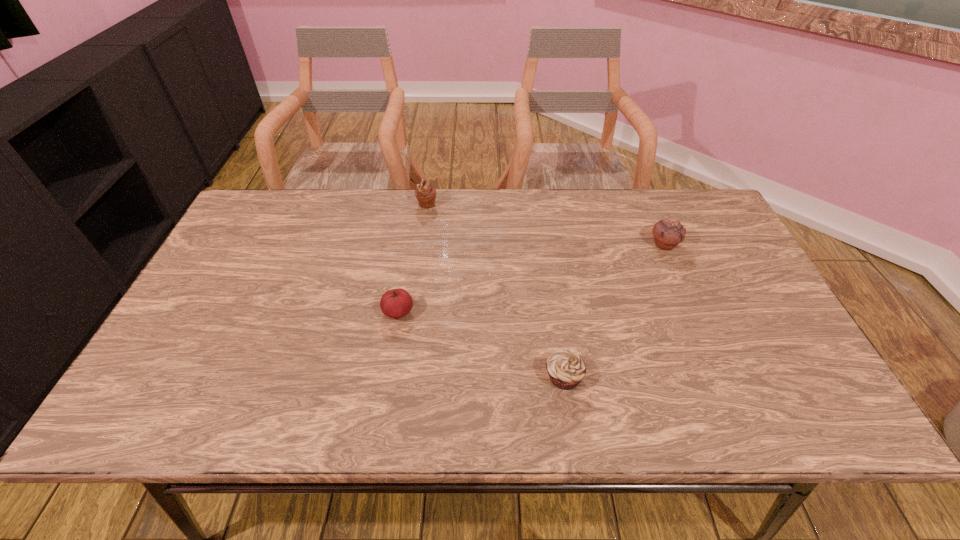
Locate an element on the screen. Image resolution: width=960 pixels, height=540 pixels. the farthest muffin is located at coordinates (425, 193).

You are a GUI agent. You are given a task and a screenshot of the screen. Output one action in this format:
    pyautogui.click(x=<x>, y=<y>)
    Task: Click on the leftmost muffin
    
    Given the screenshot: What is the action you would take?
    pyautogui.click(x=425, y=193)

Where is `the second shortest muffin`? Image resolution: width=960 pixels, height=540 pixels. the second shortest muffin is located at coordinates (667, 233).

Find the location of a particular element. The height and width of the screenshot is (540, 960). the rightmost muffin is located at coordinates (667, 233).

Locate an element on the screen. This screenshot has width=960, height=540. the third farthest object is located at coordinates (396, 303).

At what (x,y) coordinates should I click in order to perform the action: click on the second muffin from right to left. Please return your answer as a coordinate pair (x, y). Looking at the image, I should click on (566, 369).

Identify the location of the shortest muffin. [566, 369].

Identify the location of blank area located 0.110m on the right of the leftmost muffin. The height and width of the screenshot is (540, 960). (471, 205).

Find the location of a particular element. free space located 0.340m on the front of the second nearest muffin is located at coordinates point(712,355).

This screenshot has height=540, width=960. Find the location of `vacant space located 0.310m on the left of the tomato`. vacant space located 0.310m on the left of the tomato is located at coordinates (259, 312).